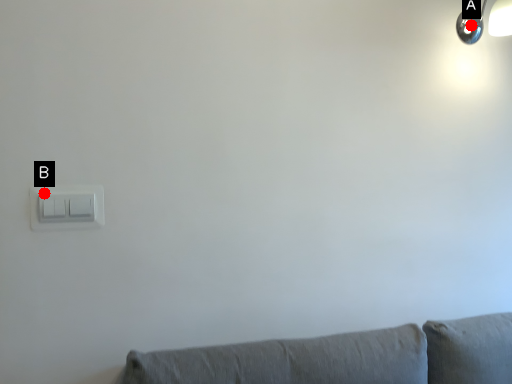
Question: Two points are circled on the image, labeled by A and B beside each circle. Which point appears farthest from the camera in this image?

Choices:
 (A) A is further
 (B) B is further

Answer: (A)